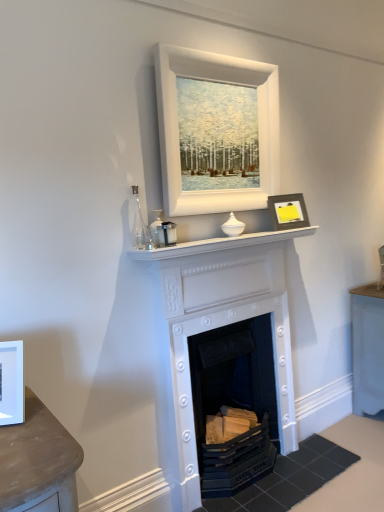
Question: Does white matte picture frame at left, the third picture frame positioned from the back, have a smaller size compared to white matte picture frame at upper center, the 2th picture frame viewed from the back?

Choices:
 (A) yes
 (B) no

Answer: (A)

Question: From a real-world perspective, does white matte picture frame at left, the third picture frame positioned from the back, stand above white matte picture frame at upper center, which is the 1th picture frame in top-to-bottom order?

Choices:
 (A) no
 (B) yes

Answer: (A)

Question: Is white matte picture frame at left, placed as the first picture frame when sorted from front to back, shorter than white matte picture frame at upper center, the 2th picture frame viewed from the back?

Choices:
 (A) yes
 (B) no

Answer: (A)

Question: Considering the relative sizes of white matte picture frame at left, the 1th picture frame in the bottom-to-top sequence, and white matte picture frame at upper center, which is the 1th picture frame in top-to-bottom order, in the image provided, is white matte picture frame at left, the 1th picture frame in the bottom-to-top sequence, taller than white matte picture frame at upper center, which is the 1th picture frame in top-to-bottom order,?

Choices:
 (A) no
 (B) yes

Answer: (A)

Question: Does white matte picture frame at left, placed as the first picture frame when sorted from front to back, appear on the left side of white matte picture frame at upper center, the 2th picture frame viewed from the back?

Choices:
 (A) yes
 (B) no

Answer: (A)

Question: Looking at their shapes, would you say white matte picture frame at left, the 1th picture frame in the bottom-to-top sequence, is wider or thinner than matte black frame at upper right, which is the 3th picture frame in front-to-back order?

Choices:
 (A) thin
 (B) wide

Answer: (B)

Question: From the image's perspective, is white matte picture frame at left, the 1th picture frame in the bottom-to-top sequence, above or below matte black frame at upper right, which is the 3th picture frame in front-to-back order?

Choices:
 (A) below
 (B) above

Answer: (A)

Question: Is point (11, 356) closer or farther from the camera than point (284, 216)?

Choices:
 (A) farther
 (B) closer

Answer: (B)

Question: In terms of size, does white matte picture frame at left, which is the third picture frame in top-to-bottom order, appear bigger or smaller than matte black frame at upper right, arranged as the second picture frame when ordered from the bottom?

Choices:
 (A) big
 (B) small

Answer: (B)

Question: Considering the positions of point (256, 322) and point (13, 348), is point (256, 322) closer or farther from the camera than point (13, 348)?

Choices:
 (A) farther
 (B) closer

Answer: (A)

Question: Based on their sizes in the image, would you say white painted wood fireplace at center, placed as the 1th fireplace when sorted from bottom to top, is bigger or smaller than white matte picture frame at left, the 1th picture frame in the bottom-to-top sequence?

Choices:
 (A) big
 (B) small

Answer: (A)

Question: In terms of height, does white painted wood fireplace at center, arranged as the 2th fireplace when viewed from the top, look taller or shorter compared to white matte picture frame at left, placed as the first picture frame when sorted from front to back?

Choices:
 (A) short
 (B) tall

Answer: (B)

Question: From the image's perspective, is white painted wood fireplace at center, placed as the 1th fireplace when sorted from bottom to top, positioned above or below white matte picture frame at left, which ranks as the 1th picture frame in left-to-right order?

Choices:
 (A) below
 (B) above

Answer: (A)

Question: In the image, is white matte picture frame at upper center, placed as the second picture frame when sorted from front to back, positioned in front of or behind white glossy mantle at center?

Choices:
 (A) front
 (B) behind

Answer: (B)

Question: Would you say white matte picture frame at upper center, placed as the second picture frame when sorted from front to back, is inside or outside white glossy mantle at center?

Choices:
 (A) outside
 (B) inside

Answer: (A)